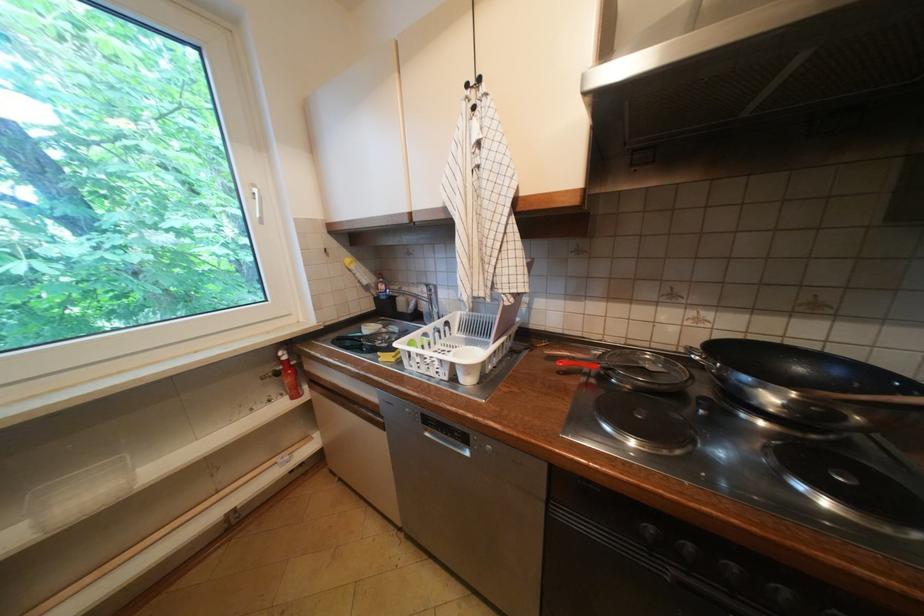
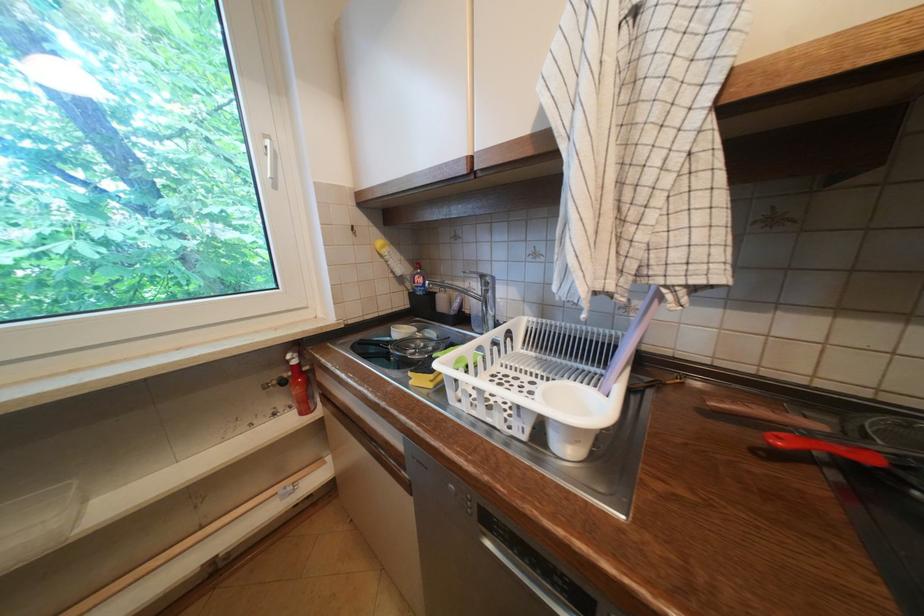
Find the pixel in the second image that matches (x=456, y=435) in the first image.

(541, 567)